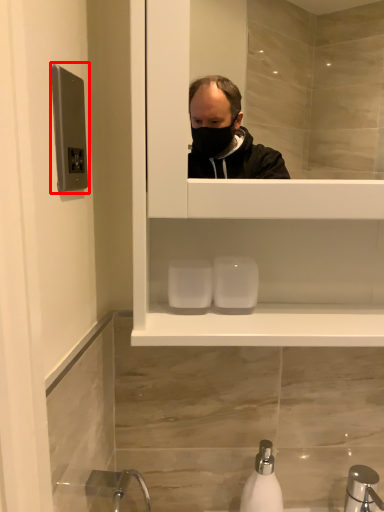
Question: Considering the relative positions of door handle (annotated by the red box) and soap dispenser in the image provided, where is door handle (annotated by the red box) located with respect to the staircase?

Choices:
 (A) right
 (B) left

Answer: (B)